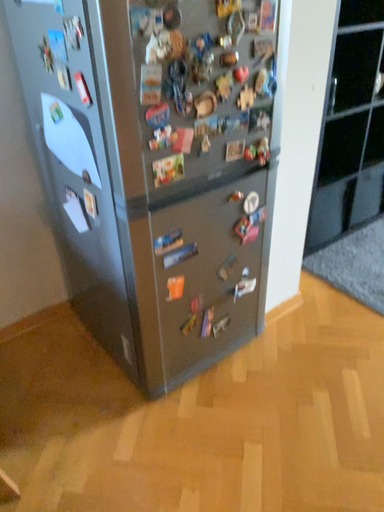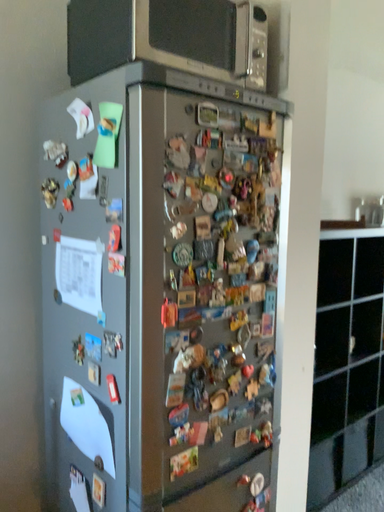
Question: Which way did the camera rotate in the video?

Choices:
 (A) rotated upward
 (B) rotated downward

Answer: (A)